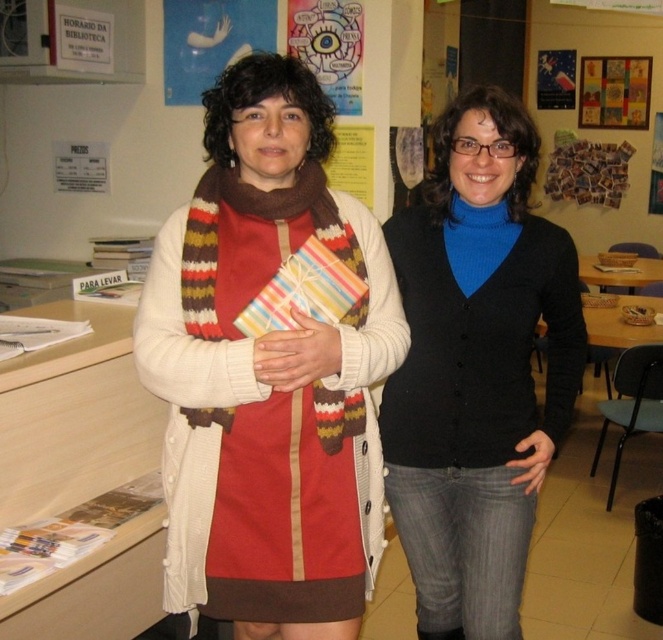
You are a visitor in the library and want to find the colorful paper poster at upper center. Where should you look relative to the two women?

The colorful paper poster at upper center is located at the upper center of the image, so you should look upwards and towards the center of the room where the two women are standing.